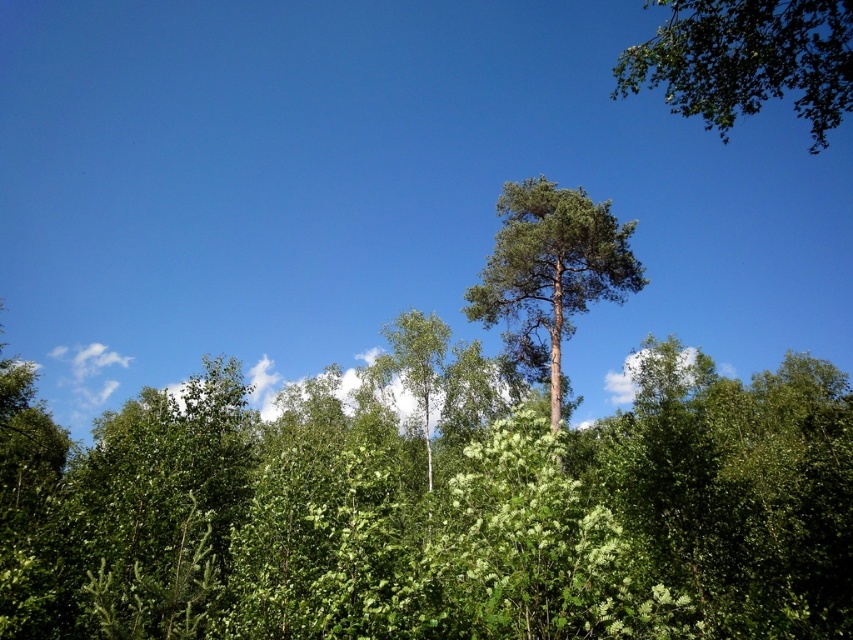
You are navigating through the forest depicted in the image. You need to move from the point at coordinates point (746, 3) to the point at coordinates point (488, 262). Which direction should you move relative to your current position?

You should move away from the viewer since point (488, 262) is further away than point (746, 3).